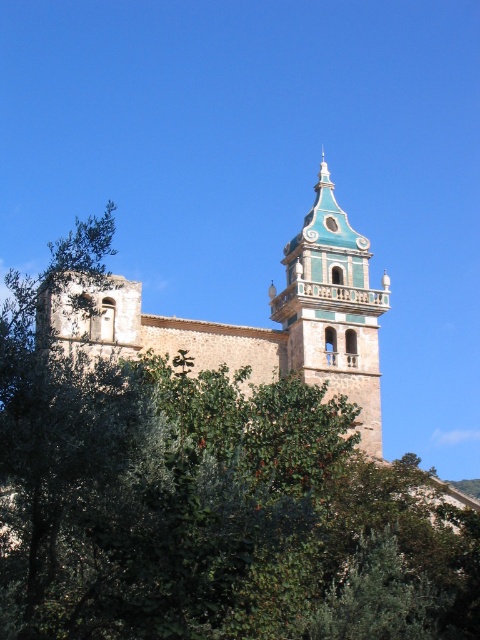
Question: Which is nearer to the light brown stone church at center?

Choices:
 (A) green leafy tree at center
 (B) blue-green glazed bell tower at center

Answer: (B)

Question: Does green leafy tree at center lie in front of light brown stone church at center?

Choices:
 (A) no
 (B) yes

Answer: (B)

Question: Which object is closer to the camera taking this photo?

Choices:
 (A) green leafy tree at center
 (B) blue-green glazed bell tower at center

Answer: (A)

Question: Can you confirm if green leafy tree at center is positioned below light brown stone church at center?

Choices:
 (A) yes
 (B) no

Answer: (A)

Question: Among these objects, which one is nearest to the camera?

Choices:
 (A) light brown stone church at center
 (B) green leafy tree at center

Answer: (B)

Question: Is green leafy tree at center below blue-green glazed bell tower at center?

Choices:
 (A) no
 (B) yes

Answer: (B)